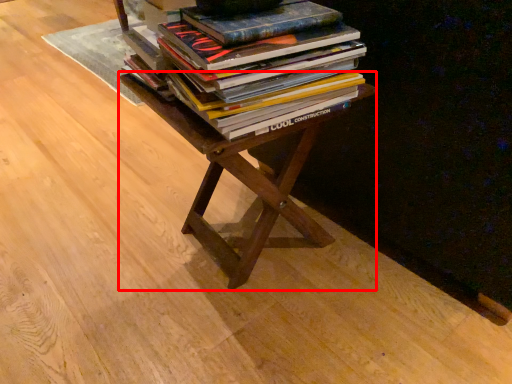
Question: Observing the image, what is the correct spatial positioning of table (annotated by the red box) in reference to book?

Choices:
 (A) right
 (B) left

Answer: (B)